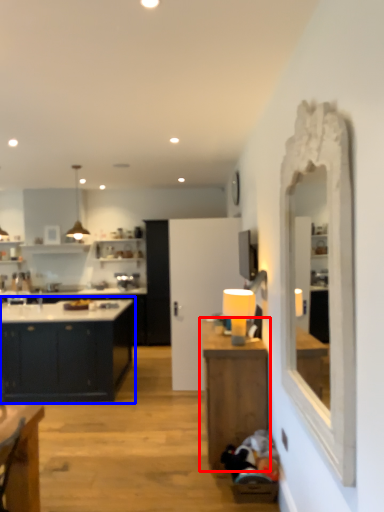
Question: Which of the following is the farthest to the observer, table (highlighted by a red box) or cabinetry (highlighted by a blue box)?

Choices:
 (A) table
 (B) cabinetry

Answer: (B)